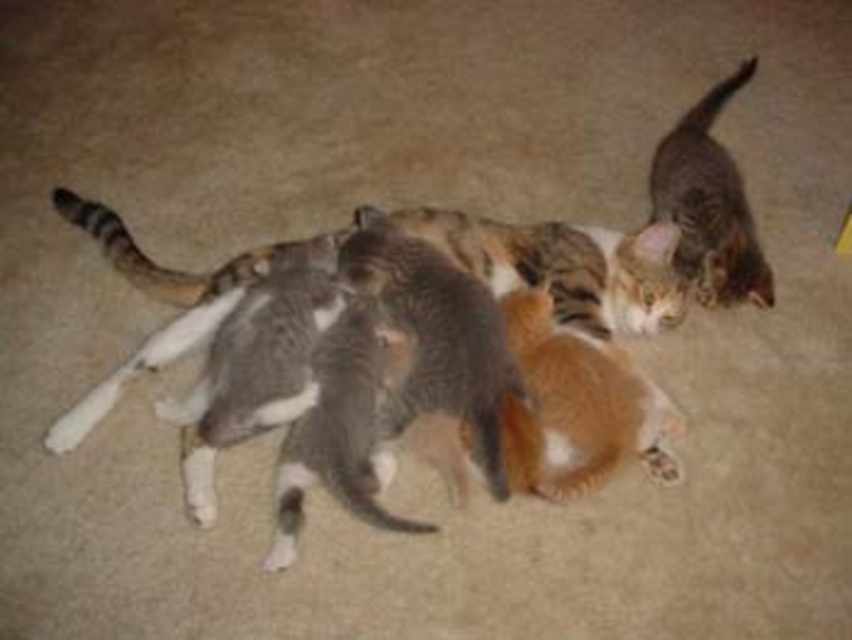
You are a photographer trying to capture a photo of the gray fur cat at center and the tabby fur cat at upper right. Based on their positions, which cat is positioned lower in the image?

The gray fur cat at center is located below the tabby fur cat at upper right, so the gray fur cat at center is positioned lower in the image.

You are a photographer trying to capture a group photo of the gray fur cat at center and the tabby fur cat at upper right. You need to ensure both cats fit within the frame. Given that your camera has a fixed width, which cat requires more space horizontally to be fully captured?

The gray fur cat at center requires more space horizontally because its width surpasses that of the tabby fur cat at upper right.